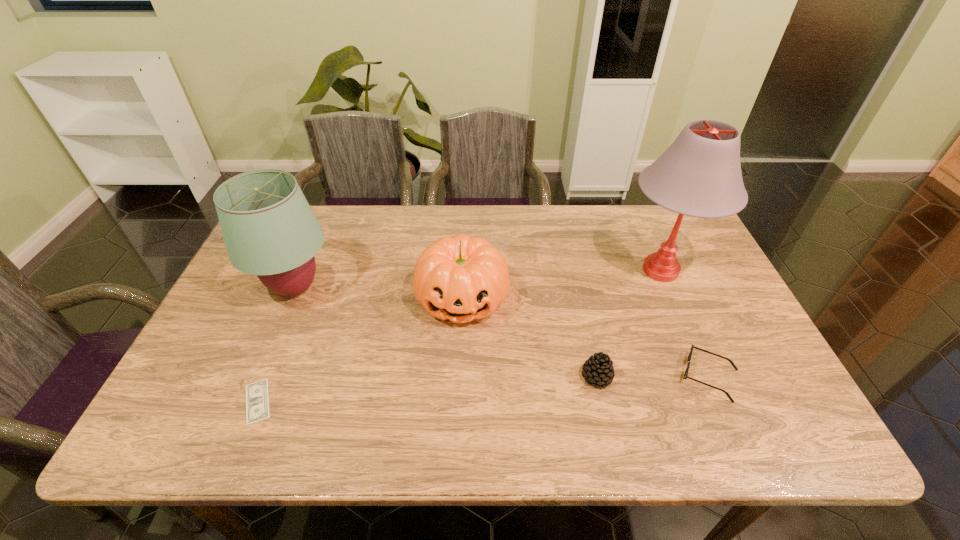
This screenshot has height=540, width=960. What are the coordinates of `object that stands as the fifth closest to the money` in the screenshot? It's located at (685, 376).

At what (x,y) coordinates should I click in order to perform the action: click on object that is the closest to the fifth shortest object. Please return your answer as a coordinate pair (x, y). Image resolution: width=960 pixels, height=540 pixels. Looking at the image, I should click on (257, 398).